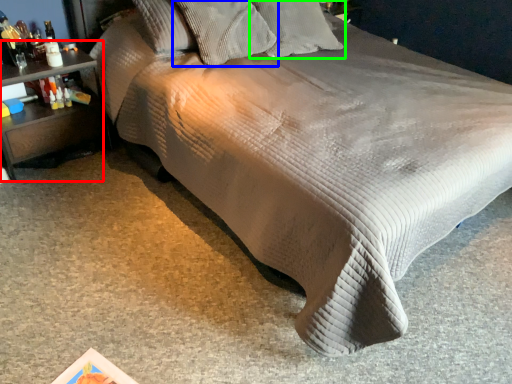
Question: Considering the real-world distances, which object is farthest from nightstand (highlighted by a red box)? pillow (highlighted by a blue box) or pillow (highlighted by a green box)?

Choices:
 (A) pillow
 (B) pillow

Answer: (B)